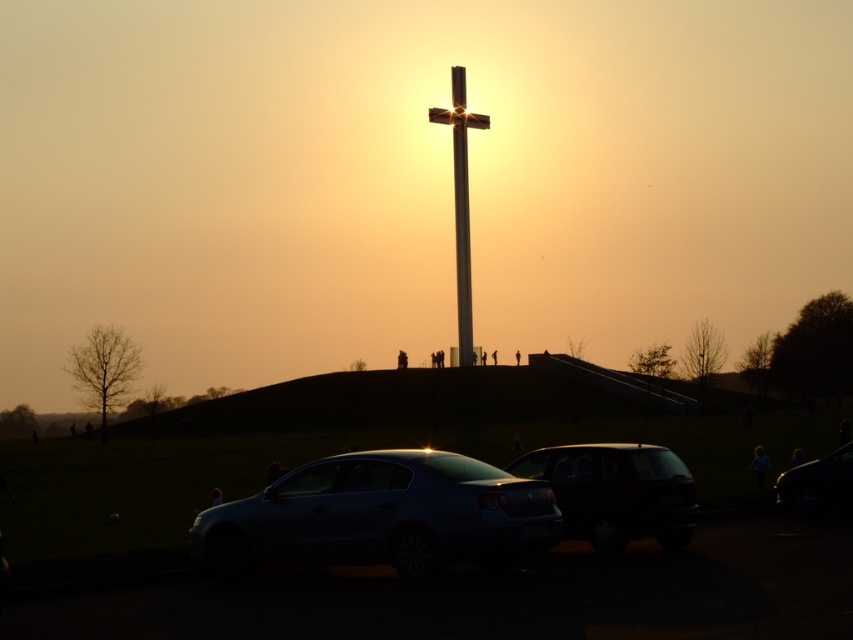
Question: Considering the real-world distances, which object is farthest from the metallic silver sedan at center?

Choices:
 (A) shiny black car at center
 (B) metallic cross at center
 (C) metallic pole at center
 (D) metallic gray car at lower center

Answer: (C)

Question: Does satin silver sedan at lower center appear over metallic cross at center?

Choices:
 (A) no
 (B) yes

Answer: (A)

Question: Considering the relative positions of metallic gray car at lower center and satin silver sedan at lower center in the image provided, where is metallic gray car at lower center located with respect to satin silver sedan at lower center?

Choices:
 (A) above
 (B) below

Answer: (B)

Question: Is metallic gray car at lower center smaller than metallic cross at center?

Choices:
 (A) no
 (B) yes

Answer: (B)

Question: Which is farther from the metallic silver sedan at center?

Choices:
 (A) metallic pole at center
 (B) satin silver sedan at lower center

Answer: (A)

Question: Which point is farther from the camera taking this photo?

Choices:
 (A) (459, 160)
 (B) (357, 579)
 (C) (521, 472)

Answer: (A)